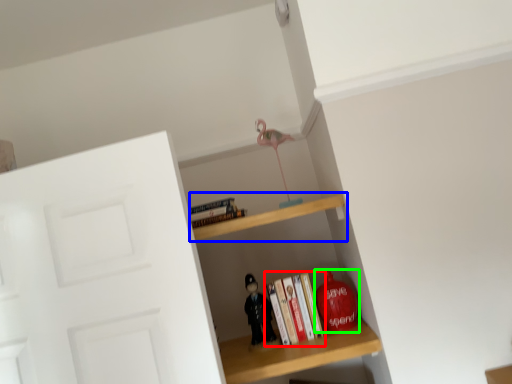
Question: Estimate the real-world distances between objects in this image. Which object is farther from book (highlighted by a red box), shelf (highlighted by a blue box) or toy (highlighted by a green box)?

Choices:
 (A) shelf
 (B) toy

Answer: (A)